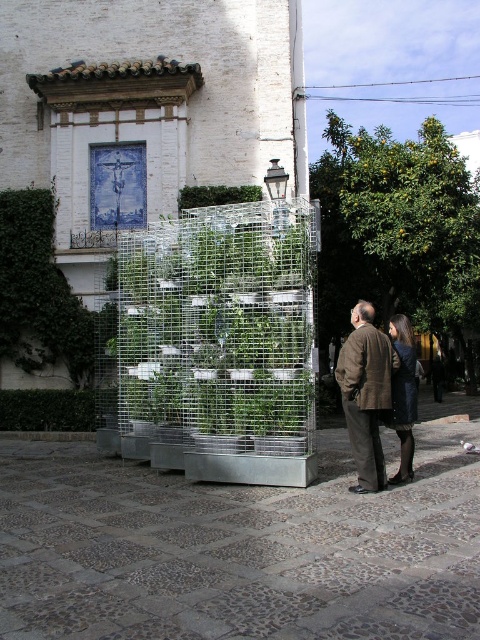
Question: Which of the following is the closest to the observer?

Choices:
 (A) brown woolen coat at center
 (B) green leafy hedge at right
 (C) green leafy hedge at lower left

Answer: (A)

Question: Does green ivy hedge at upper left appear on the right side of brown woolen coat at center?

Choices:
 (A) no
 (B) yes

Answer: (A)

Question: Is green ivy hedge at upper left to the right of green leafy hedge at lower left from the viewer's perspective?

Choices:
 (A) no
 (B) yes

Answer: (A)

Question: Which point is closer to the camera?

Choices:
 (A) (81, 422)
 (B) (313, 276)

Answer: (B)

Question: Among these objects, which one is farthest from the camera?

Choices:
 (A) brown woolen coat at center
 (B) green ivy hedge at upper left
 (C) dark brown leather coat at lower right

Answer: (B)

Question: Considering the relative positions of clear wire mesh at center and brown woolen coat at center in the image provided, where is clear wire mesh at center located with respect to brown woolen coat at center?

Choices:
 (A) below
 (B) above

Answer: (A)